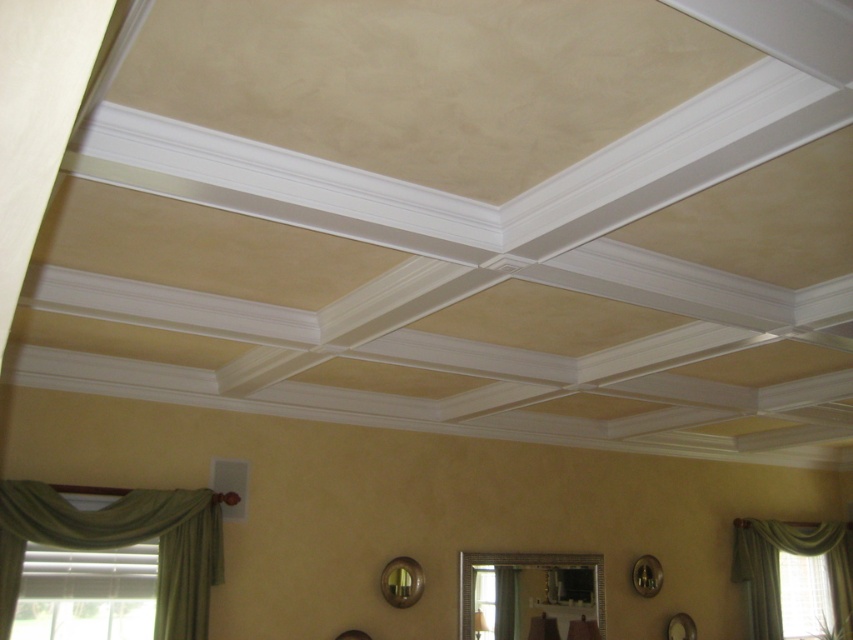
Question: In this image, where is green fabric curtain at lower left located relative to green fabric curtain at lower right?

Choices:
 (A) above
 (B) below

Answer: (A)

Question: Is green fabric curtain at lower left to the left of green fabric curtain at lower right from the viewer's perspective?

Choices:
 (A) yes
 (B) no

Answer: (A)

Question: Can you confirm if green fabric curtain at lower left is wider than green fabric curtain at lower right?

Choices:
 (A) yes
 (B) no

Answer: (B)

Question: Among these objects, which one is nearest to the camera?

Choices:
 (A) green fabric curtain at lower left
 (B) green fabric curtain at lower right

Answer: (A)

Question: Which point is farther to the camera?

Choices:
 (A) green fabric curtain at lower right
 (B) green fabric curtain at lower left

Answer: (A)